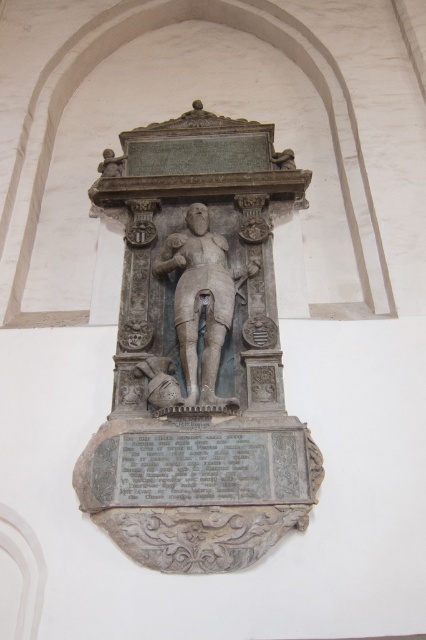
Question: Which point is farther from the camera taking this photo?

Choices:
 (A) (181, 291)
 (B) (265, 547)

Answer: (A)

Question: Can you confirm if gray stone statue at center is wider than stone statue at center?

Choices:
 (A) yes
 (B) no

Answer: (A)

Question: Is gray stone statue at center bigger than stone statue at center?

Choices:
 (A) yes
 (B) no

Answer: (A)

Question: Which point is farther to the camera?

Choices:
 (A) stone statue at center
 (B) gray stone statue at center

Answer: (A)

Question: Is gray stone statue at center thinner than stone statue at center?

Choices:
 (A) yes
 (B) no

Answer: (B)

Question: Which of the following is the closest to the observer?

Choices:
 (A) (224, 424)
 (B) (189, 262)

Answer: (A)